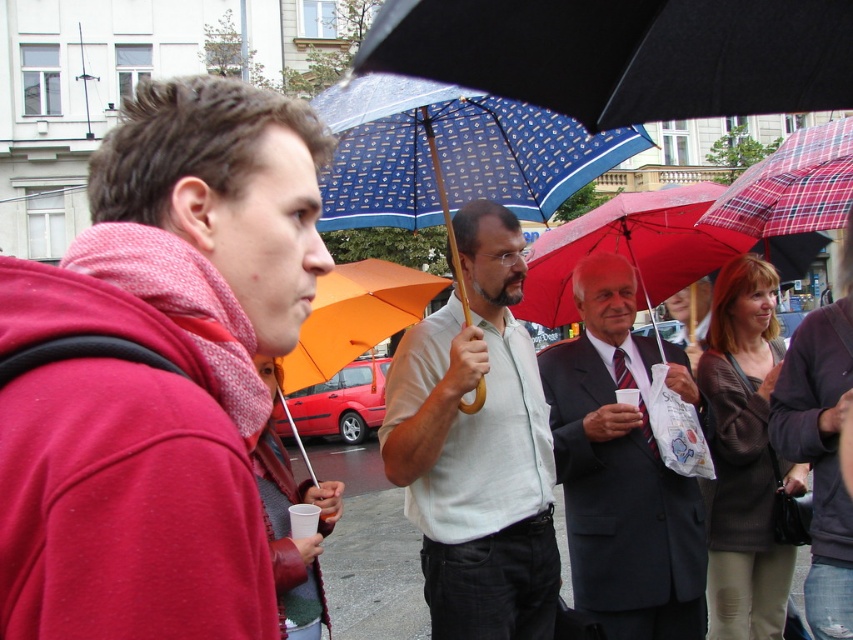
Can you confirm if light beige shirt at center is smaller than plaid fabric umbrella at center?

No.

Is light beige shirt at center to the right of plaid fabric umbrella at center from the viewer's perspective?

In fact, light beige shirt at center is to the left of plaid fabric umbrella at center.

Which is behind, point (451, 552) or point (815, 195)?

The point (451, 552) is behind.

Identify the location of light beige shirt at center. (477, 448).

Between point (250, 484) and point (341, 524), which one is positioned behind?

Positioned behind is point (341, 524).

Can you confirm if matte red hoodie at left is thinner than smooth asphalt pavement at center?

Correct, matte red hoodie at left's width is less than smooth asphalt pavement at center's.

Between point (259, 134) and point (354, 616), which one is positioned in front?

Point (259, 134) is more forward.

Locate an element on the screen. This screenshot has width=853, height=640. matte red hoodie at left is located at coordinates (160, 372).

This screenshot has width=853, height=640. Describe the element at coordinates (160, 372) in the screenshot. I see `matte red hoodie at left` at that location.

Does matte red hoodie at left have a greater width compared to blue printed fabric umbrella at upper center?

Incorrect, matte red hoodie at left's width does not surpass blue printed fabric umbrella at upper center's.

This screenshot has height=640, width=853. I want to click on matte red hoodie at left, so click(160, 372).